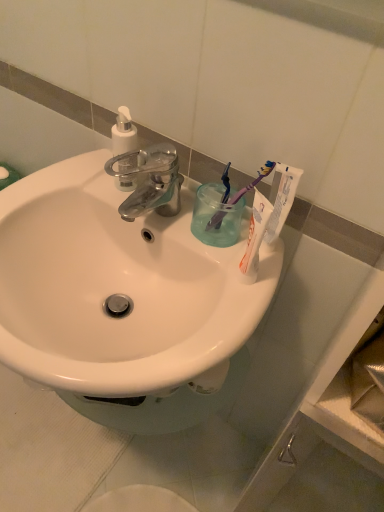
Where is `free space in front of purple plastic toothbrush at upper right, which is the second toothbrush in left-to-right order`? This screenshot has width=384, height=512. free space in front of purple plastic toothbrush at upper right, which is the second toothbrush in left-to-right order is located at coordinates (232, 295).